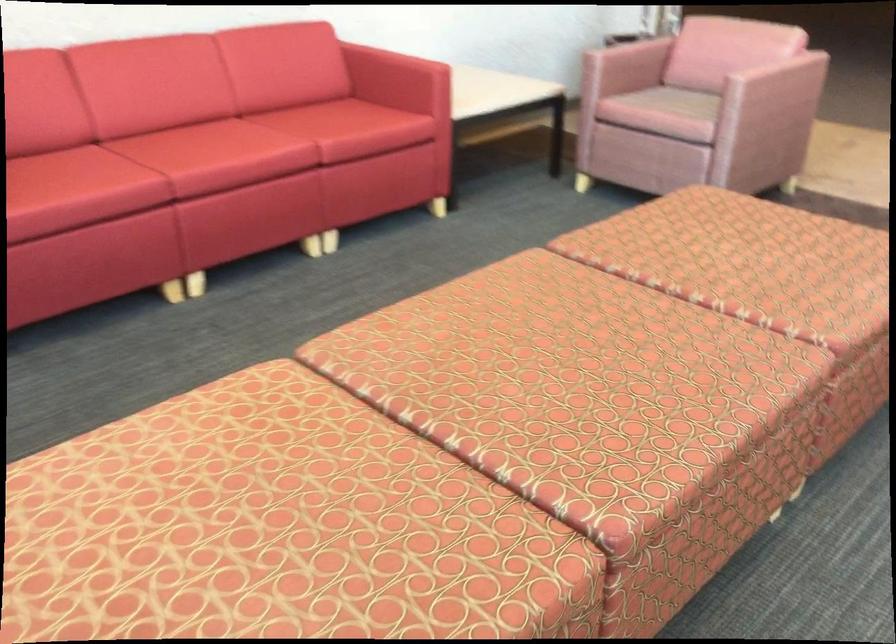
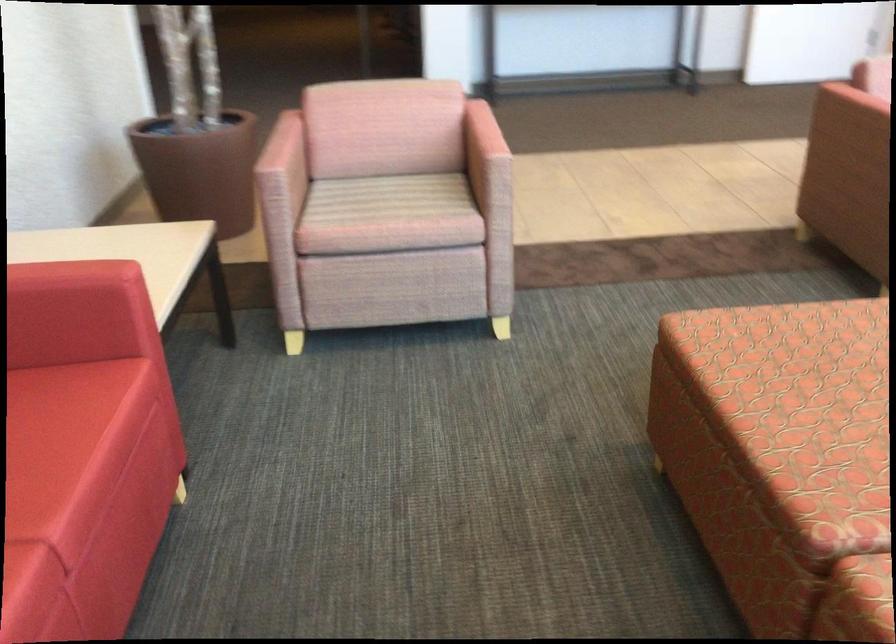
Question: I am providing you with two images of the same scene from different viewpoints. Which of the following objects are not visible in image2?

Choices:
 (A) control panel buttons
 (B) patterned sofa sitting surface
 (C) sofa armrest
 (D) red sofa sitting surface

Answer: (C)